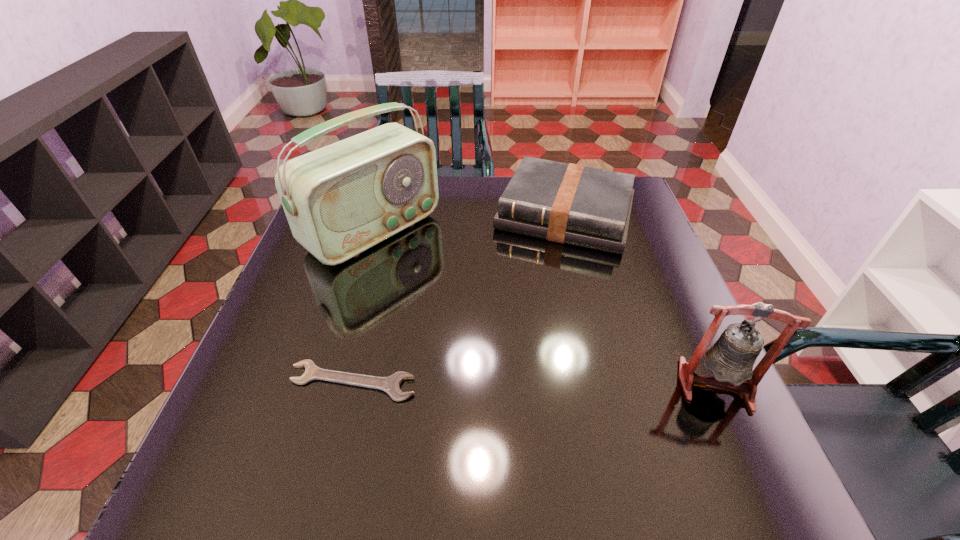
Identify the location of free space between the radio receiver and the wrench. (x=363, y=306).

The width and height of the screenshot is (960, 540). Find the location of `free area in between the tallest object and the wrench`. free area in between the tallest object and the wrench is located at coordinates click(363, 306).

Find the location of a particular element. The width and height of the screenshot is (960, 540). vacant area that lies between the shortest object and the second tallest object is located at coordinates (534, 383).

Identify the location of free space between the radio receiver and the hardback book. The height and width of the screenshot is (540, 960). (469, 223).

You are a GUI agent. You are given a task and a screenshot of the screen. Output one action in this format:
    pyautogui.click(x=<x>, y=<y>)
    Task: Click on the empty location between the tallest object and the second shortest object
    
    Given the screenshot: What is the action you would take?
    pyautogui.click(x=469, y=223)

Locate an element on the screen. free space that is in between the hardback book and the radio receiver is located at coordinates (469, 223).

You are a GUI agent. You are given a task and a screenshot of the screen. Output one action in this format:
    pyautogui.click(x=<x>, y=<y>)
    Task: Click on the free area in between the radio receiver and the second shortest object
    
    Given the screenshot: What is the action you would take?
    pyautogui.click(x=469, y=223)

Find the location of a particular element. the third closest object to the hardback book is located at coordinates (391, 385).

Locate which object is the closest to the second shortest object. Please provide its 2D coordinates. Your answer should be formatted as a tuple, i.e. [(x, y)], where the tuple contains the x and y coordinates of a point satisfying the conditions above.

[(342, 199)]

The width and height of the screenshot is (960, 540). I want to click on vacant area that satisfies the following two spatial constraints: 1. on the front side of the radio receiver; 2. on the left side of the wrench, so click(329, 381).